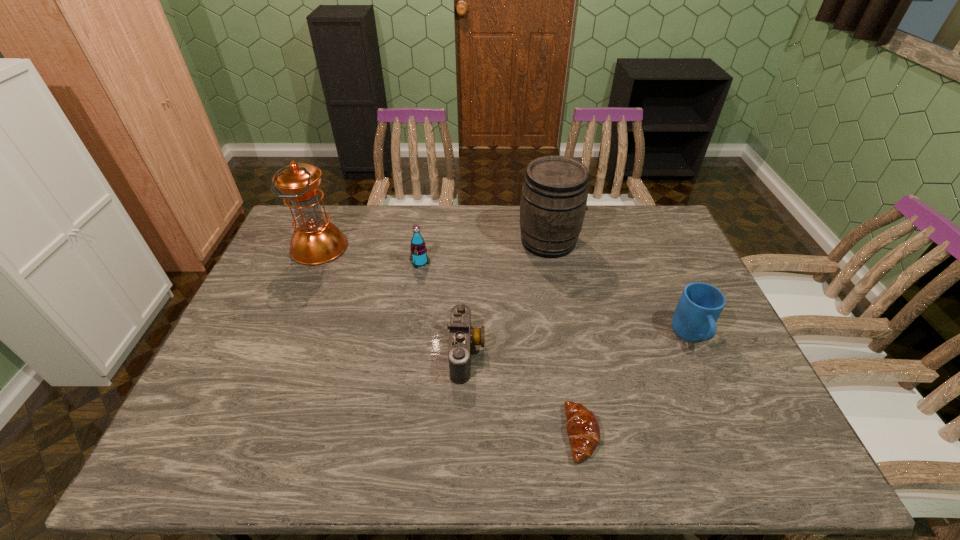
Find the location of a particular element. the tallest object is located at coordinates (316, 241).

Identify the location of oil lamp. (x=316, y=241).

You are a GUI agent. You are given a task and a screenshot of the screen. Output one action in this format:
    pyautogui.click(x=<x>, y=<y>)
    Task: Click on the wine bucket
    
    Given the screenshot: What is the action you would take?
    pyautogui.click(x=554, y=196)

Where is `soda`? The image size is (960, 540). soda is located at coordinates (419, 258).

Where is `the rightmost object`? The image size is (960, 540). the rightmost object is located at coordinates (700, 305).

Locate an element on the screen. camera is located at coordinates (462, 336).

At what (x,y) coordinates should I click in order to perform the action: click on the third object from left to right. Please return your answer as a coordinate pair (x, y). Looking at the image, I should click on (462, 336).

The image size is (960, 540). Identify the location of the shortest object. (583, 429).

Locate an element on the screen. The width and height of the screenshot is (960, 540). crescent roll is located at coordinates (583, 429).

Where is `free space located 0.060m on the front of the tallest object`? The height and width of the screenshot is (540, 960). free space located 0.060m on the front of the tallest object is located at coordinates (305, 280).